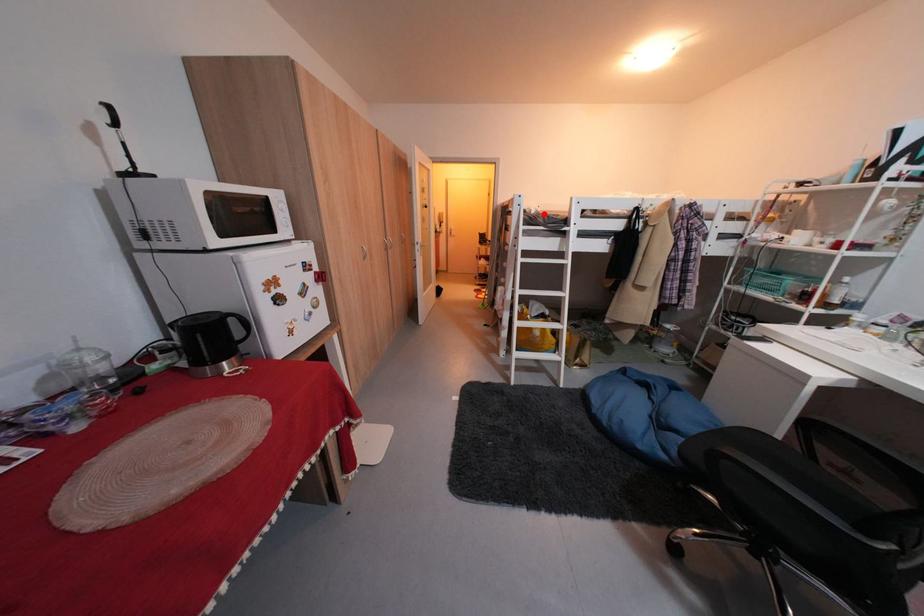
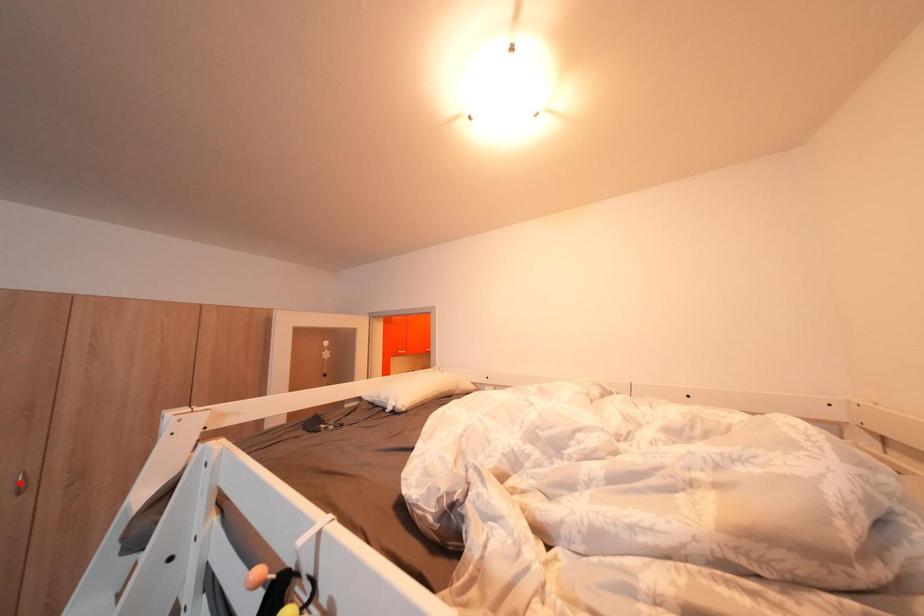
I am providing you with two images of the same scene from different viewpoints. A red point is marked on the first image and another point is marked on the second image. Are the points marked in image1 and image2 representing the same 3D position?

No